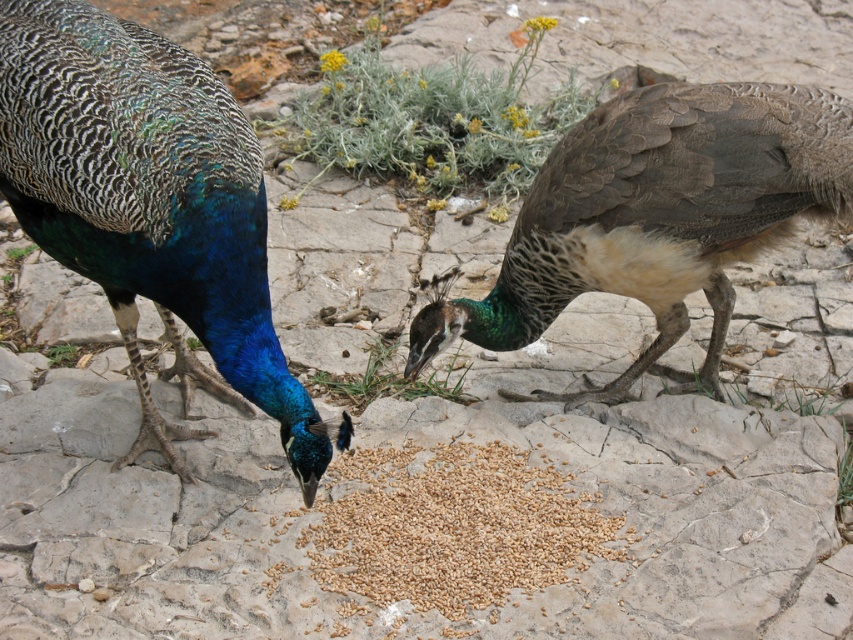
Does brown textured peacock at right appear on the right side of brown matte grain at center?

Yes, brown textured peacock at right is to the right of brown matte grain at center.

Who is more forward, (x=465, y=326) or (x=490, y=596)?

Point (x=490, y=596) is more forward.

Image resolution: width=853 pixels, height=640 pixels. What are the coordinates of `brown textured peacock at right` in the screenshot? It's located at (654, 216).

Does shiny blue peacock at left appear on the left side of brown matte grain at center?

Indeed, shiny blue peacock at left is positioned on the left side of brown matte grain at center.

Which is in front, point (137, 272) or point (444, 614)?

Positioned in front is point (137, 272).

Identify the location of shiny blue peacock at left. Image resolution: width=853 pixels, height=640 pixels. (151, 209).

Between shiny blue peacock at left and brown textured peacock at right, which one has less height?

Standing shorter between the two is brown textured peacock at right.

Is shiny blue peacock at left positioned behind brown textured peacock at right?

No.

Find the location of `shiny blue peacock at left`. shiny blue peacock at left is located at coordinates (151, 209).